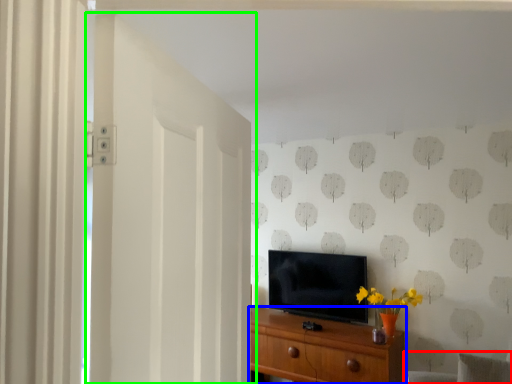
Question: Based on their relative distances, which object is nearer to swivel chair (highlighted by a red box)? Choose from chest of drawers (highlighted by a blue box) and door (highlighted by a green box).

Choices:
 (A) chest of drawers
 (B) door

Answer: (A)